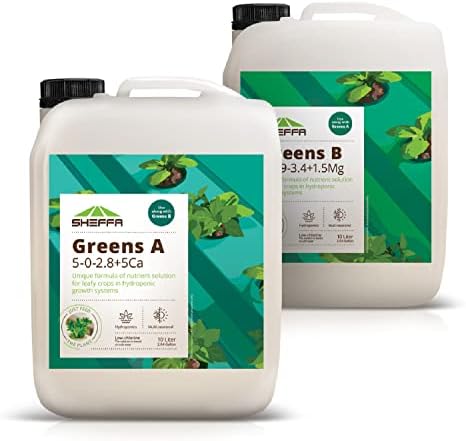
In order to click on white wall in this screenshot , I will do [x=140, y=29].